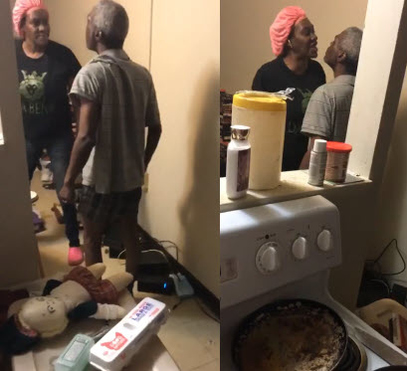
You are a GUI agent. You are given a task and a screenshot of the screen. Output one action in this format:
    pyautogui.click(x=<x>, y=<y>)
    Task: Click on the stove knobs
    
    Given the screenshot: What is the action you would take?
    pyautogui.click(x=273, y=263), pyautogui.click(x=297, y=249), pyautogui.click(x=323, y=243)